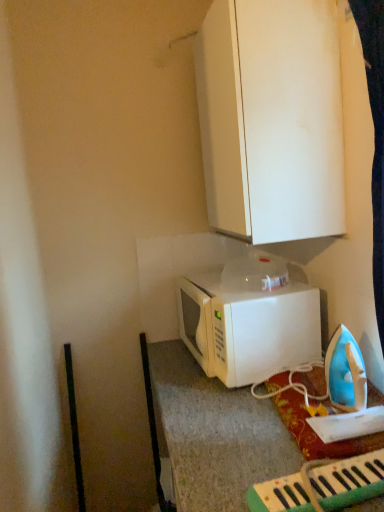
Question: From the image's perspective, is white matte microwave at center located above white matte cabinet at upper center?

Choices:
 (A) no
 (B) yes

Answer: (A)

Question: Is there a large distance between white matte microwave at center and white matte cabinet at upper center?

Choices:
 (A) no
 (B) yes

Answer: (A)

Question: Is white matte microwave at center aimed at white matte cabinet at upper center?

Choices:
 (A) yes
 (B) no

Answer: (B)

Question: Can you confirm if white matte microwave at center is wider than white matte cabinet at upper center?

Choices:
 (A) no
 (B) yes

Answer: (B)

Question: Is white matte cabinet at upper center at the back of white matte microwave at center?

Choices:
 (A) no
 (B) yes

Answer: (A)

Question: From the image's perspective, does white matte microwave at center appear lower than white matte cabinet at upper center?

Choices:
 (A) yes
 (B) no

Answer: (A)

Question: Is white matte cabinet at upper center outside white matte microwave at center?

Choices:
 (A) no
 (B) yes

Answer: (B)

Question: From the image's perspective, is white matte cabinet at upper center above white matte microwave at center?

Choices:
 (A) yes
 (B) no

Answer: (A)

Question: From a real-world perspective, does white matte cabinet at upper center stand above white matte microwave at center?

Choices:
 (A) yes
 (B) no

Answer: (A)

Question: Does white matte cabinet at upper center have a greater height compared to white matte microwave at center?

Choices:
 (A) no
 (B) yes

Answer: (B)

Question: Is the depth of white matte cabinet at upper center less than that of white matte microwave at center?

Choices:
 (A) no
 (B) yes

Answer: (B)

Question: Can you confirm if white matte cabinet at upper center is wider than white matte microwave at center?

Choices:
 (A) yes
 (B) no

Answer: (B)

Question: Is green plastic keyboard at lower right at the right side of white matte cabinet at upper center?

Choices:
 (A) no
 (B) yes

Answer: (B)